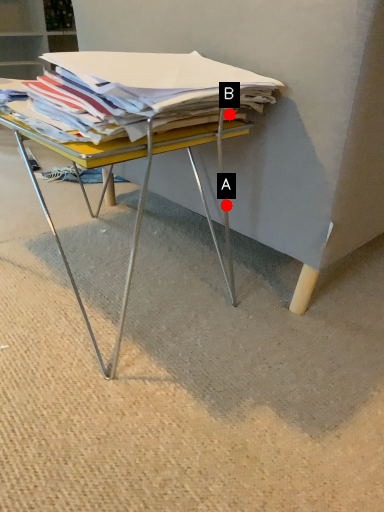
Question: Two points are circled on the image, labeled by A and B beside each circle. Which point is closer to the camera?

Choices:
 (A) A is closer
 (B) B is closer

Answer: (B)